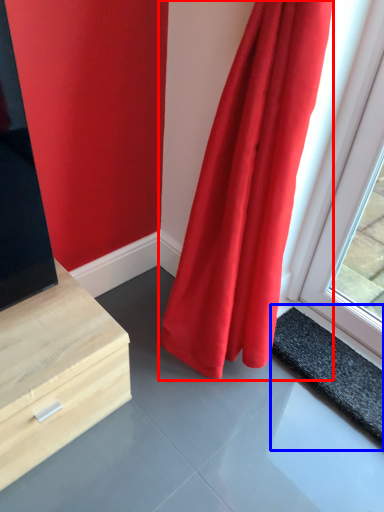
Question: Which object appears farthest to the camera in this image, curtain (highlighted by a red box) or slate (highlighted by a blue box)?

Choices:
 (A) curtain
 (B) slate

Answer: (B)